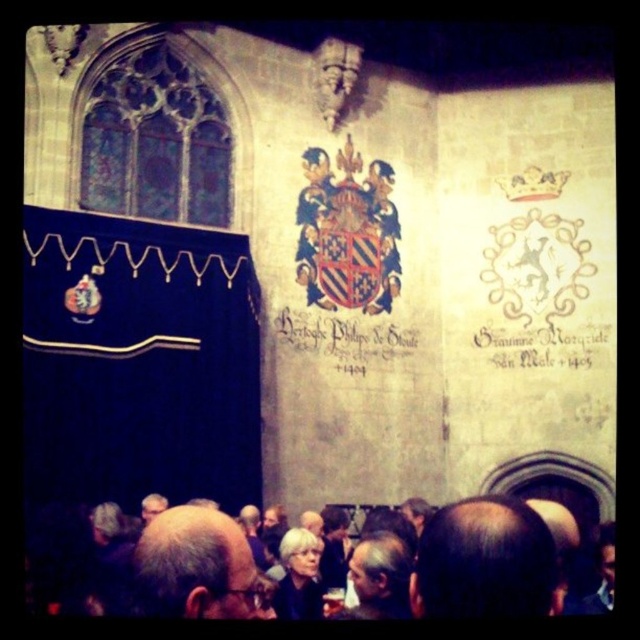
Does gray hair at lower center have a larger size compared to gray hair at center?

Yes.

Is gray hair at lower center to the left of gray hair at center from the viewer's perspective?

No, gray hair at lower center is not to the left of gray hair at center.

Image resolution: width=640 pixels, height=640 pixels. What do you see at coordinates (166, 568) in the screenshot? I see `gray hair at lower center` at bounding box center [166, 568].

You are a GUI agent. You are given a task and a screenshot of the screen. Output one action in this format:
    pyautogui.click(x=<x>, y=<y>)
    Task: Click on the gray hair at lower center
    The width and height of the screenshot is (640, 640).
    Given the screenshot: What is the action you would take?
    pyautogui.click(x=166, y=568)

Does gray hair at center appear over black paper scroll at center?

No, gray hair at center is not above black paper scroll at center.

Which is behind, point (225, 516) or point (397, 348)?

Positioned behind is point (397, 348).

You are a GUI agent. You are given a task and a screenshot of the screen. Output one action in this format:
    pyautogui.click(x=<x>, y=<y>)
    Task: Click on the gray hair at center
    The width and height of the screenshot is (640, 640).
    Given the screenshot: What is the action you would take?
    pyautogui.click(x=195, y=566)

Is gray hair at lower center thinner than black paper scroll at center?

In fact, gray hair at lower center might be wider than black paper scroll at center.

Which of these two, gray hair at lower center or black paper scroll at center, stands shorter?

With less height is black paper scroll at center.

Find the location of a particular element. This screenshot has width=640, height=640. gray hair at lower center is located at coordinates (166, 568).

In order to click on gray hair at lower center in this screenshot , I will do `click(166, 568)`.